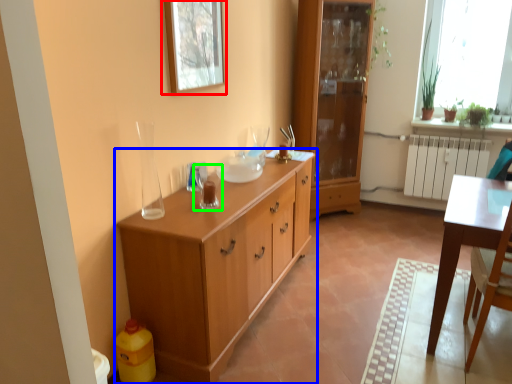
Question: Based on their relative distances, which object is farther from picture frame (highlighted by a red box)? Choose from chest of drawers (highlighted by a blue box) and tableware (highlighted by a green box).

Choices:
 (A) chest of drawers
 (B) tableware

Answer: (A)